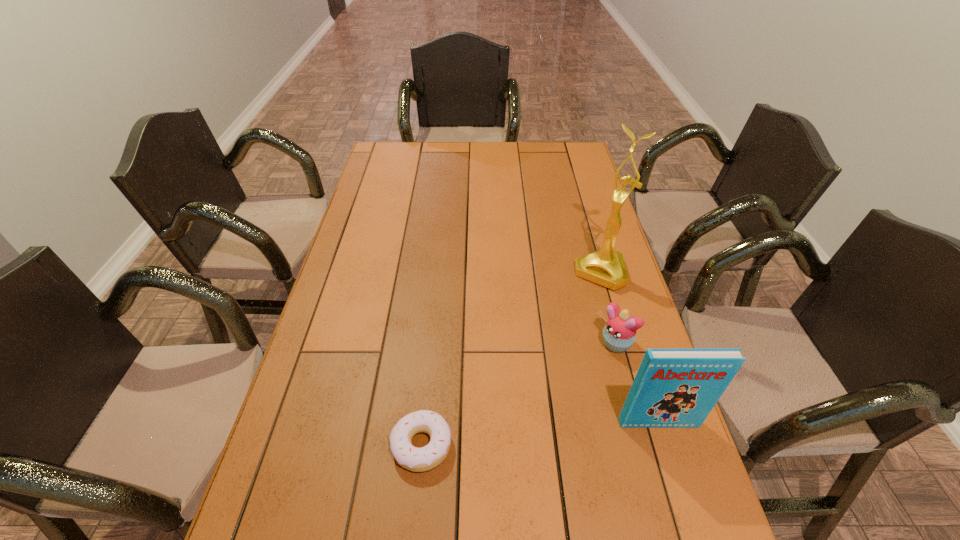
This screenshot has width=960, height=540. In order to click on doughnut in this screenshot , I will do `click(415, 459)`.

I want to click on the leftmost object, so click(415, 459).

Where is `book`? book is located at coordinates tap(674, 388).

This screenshot has width=960, height=540. In order to click on the second shortest object in this screenshot , I will do `click(619, 333)`.

I want to click on cupcake, so click(x=619, y=333).

Where is `award`? award is located at coordinates (606, 267).

In order to click on the farthest object in this screenshot , I will do `click(606, 267)`.

Identify the location of free spot located 0.080m on the left of the shortest object. The width and height of the screenshot is (960, 540). (355, 446).

I want to click on free location located 0.200m on the front cover of the book, so click(x=690, y=525).

Where is `vacant space located on the face of the third tallest object`? The width and height of the screenshot is (960, 540). vacant space located on the face of the third tallest object is located at coordinates (527, 424).